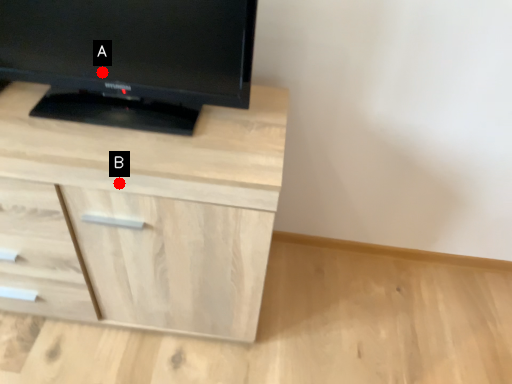
Question: Two points are circled on the image, labeled by A and B beside each circle. Which point is farther to the camera?

Choices:
 (A) A is further
 (B) B is further

Answer: (A)